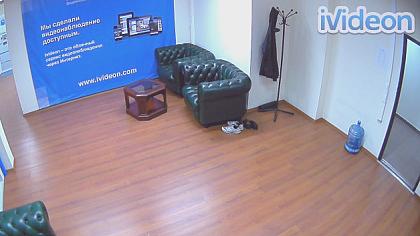
You are a GUI agent. You are given a task and a screenshot of the screen. Output one action in this format:
    pyautogui.click(x=<x>, y=<y>)
    Task: Click on the coat hanger
    This screenshot has height=236, width=420.
    Given the screenshot: What is the action you would take?
    pyautogui.click(x=278, y=100)